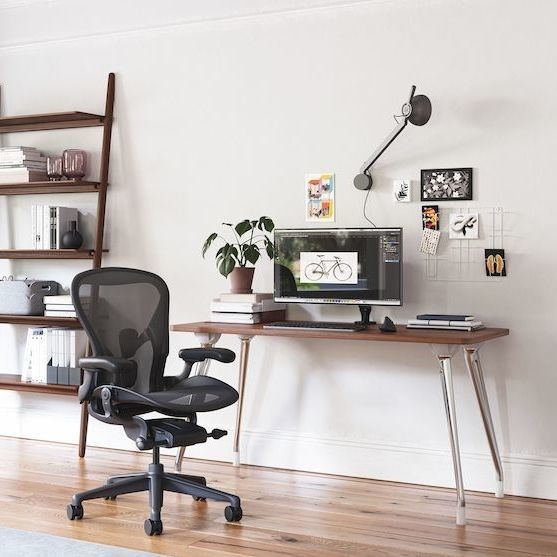
Where is `keyboard`? keyboard is located at coordinates (330, 324).